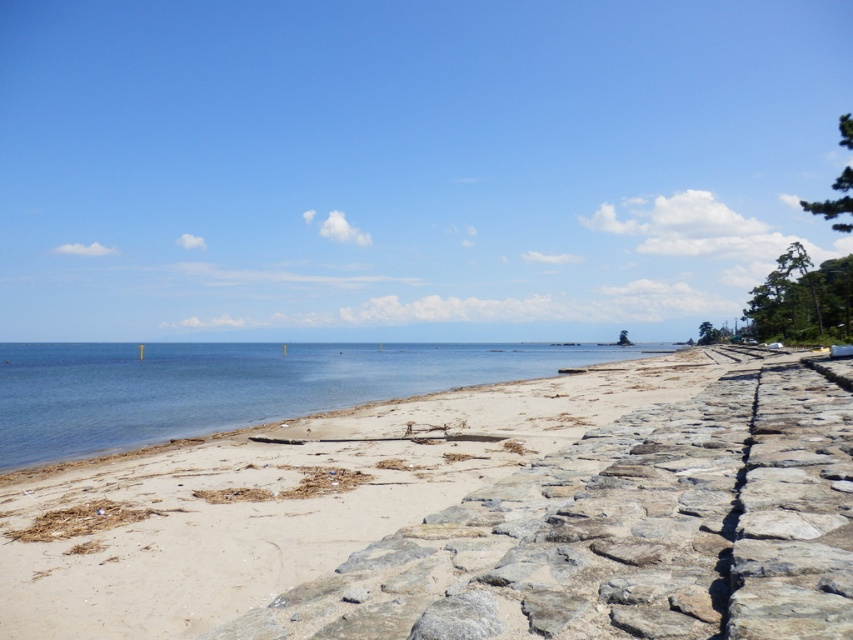
Question: Which point appears closest to the camera in this image?

Choices:
 (A) (196, 417)
 (B) (535, 412)

Answer: (B)

Question: Which point is closer to the camera?

Choices:
 (A) (689, 349)
 (B) (305, 346)

Answer: (A)

Question: Is light brown sand at lower left below blue water at center?

Choices:
 (A) yes
 (B) no

Answer: (B)

Question: Which object appears farthest from the camera in this image?

Choices:
 (A) blue water at center
 (B) light brown sand at lower left

Answer: (A)

Question: Can you confirm if light brown sand at lower left is wider than blue water at center?

Choices:
 (A) yes
 (B) no

Answer: (B)

Question: Where is light brown sand at lower left located in relation to blue water at center in the image?

Choices:
 (A) right
 (B) left

Answer: (A)